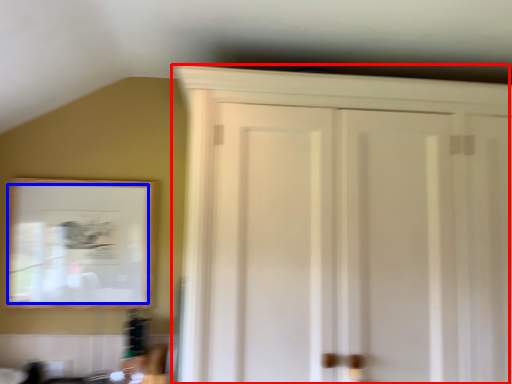
Question: Which of the following is the farthest to the observer, cupboard (highlighted by a red box) or mirror (highlighted by a blue box)?

Choices:
 (A) cupboard
 (B) mirror

Answer: (B)